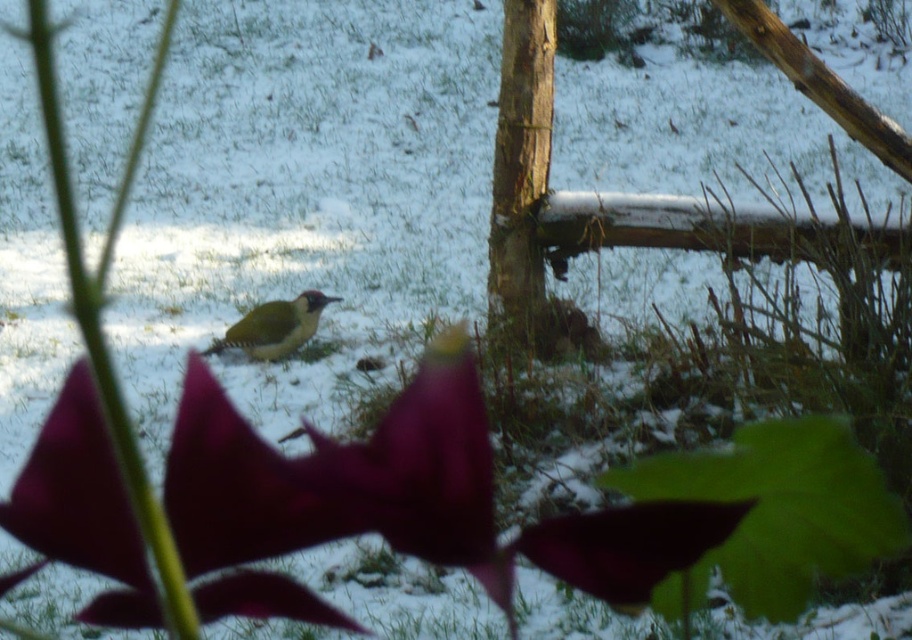
Is shiny purple petal at center behind green matte woodpecker at center?

No, it is in front of green matte woodpecker at center.

Can you confirm if shiny purple petal at center is bigger than green matte woodpecker at center?

Incorrect, shiny purple petal at center is not larger than green matte woodpecker at center.

Locate an element on the screen. The height and width of the screenshot is (640, 912). shiny purple petal at center is located at coordinates (234, 486).

Locate an element on the screen. The width and height of the screenshot is (912, 640). shiny purple petal at center is located at coordinates (234, 486).

Is shiny purple petal at center to the left of smooth bark tree trunk at center from the viewer's perspective?

Correct, you'll find shiny purple petal at center to the left of smooth bark tree trunk at center.

Can you confirm if shiny purple petal at center is positioned to the right of smooth bark tree trunk at center?

No, shiny purple petal at center is not to the right of smooth bark tree trunk at center.

This screenshot has height=640, width=912. I want to click on shiny purple petal at center, so click(x=234, y=486).

Where is `shiny purple petal at center`? The image size is (912, 640). shiny purple petal at center is located at coordinates (234, 486).

Who is taller, smooth bark tree trunk at center or green matte woodpecker at center?

smooth bark tree trunk at center

Is point (532, 72) farther from viewer compared to point (314, 308)?

No, it is in front of (314, 308).

Who is more distant from viewer, (x=537, y=321) or (x=254, y=348)?

The point (x=254, y=348) is more distant.

This screenshot has height=640, width=912. Find the location of `smooth bark tree trunk at center`. smooth bark tree trunk at center is located at coordinates (520, 172).